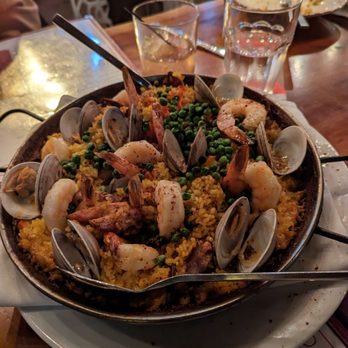
Identify the location of spoon. The width and height of the screenshot is (348, 348). (180, 276).